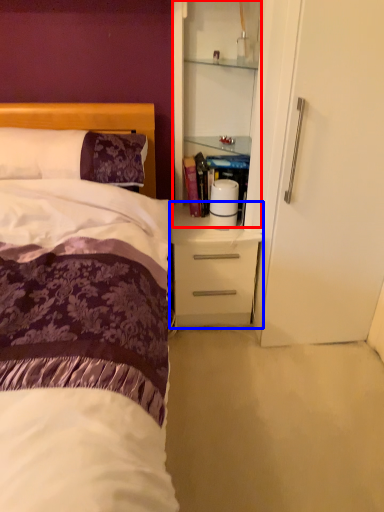
Question: Which point is further to the camera, cabinetry (highlighted by a red box) or desk (highlighted by a blue box)?

Choices:
 (A) cabinetry
 (B) desk

Answer: (B)